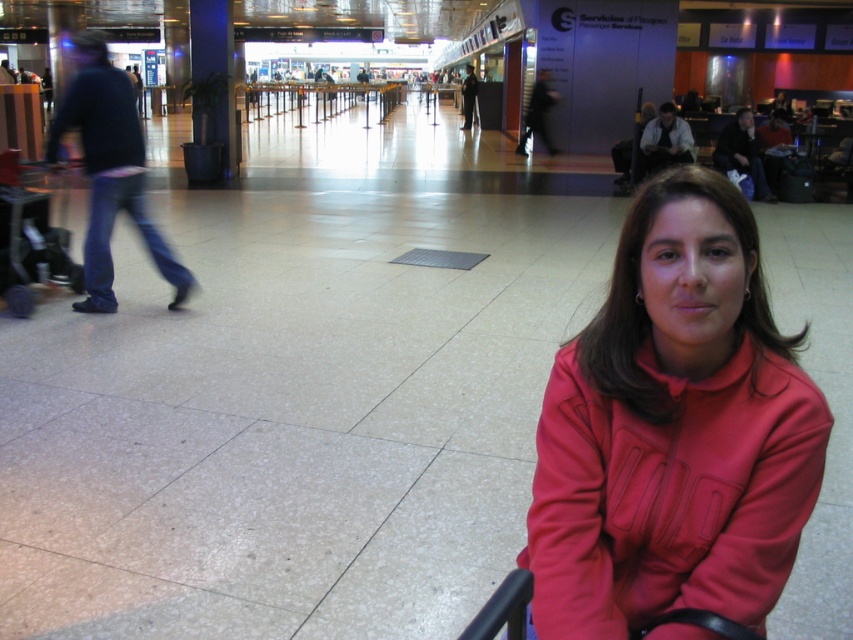
Question: Is matte red jacket at lower right to the left of jeans at left from the viewer's perspective?

Choices:
 (A) yes
 (B) no

Answer: (B)

Question: Which point is farther from the camera taking this photo?

Choices:
 (A) (643, 348)
 (B) (90, 84)

Answer: (B)

Question: Is matte red jacket at lower right above jeans at left?

Choices:
 (A) no
 (B) yes

Answer: (A)

Question: Does matte red jacket at lower right have a greater width compared to jeans at left?

Choices:
 (A) no
 (B) yes

Answer: (A)